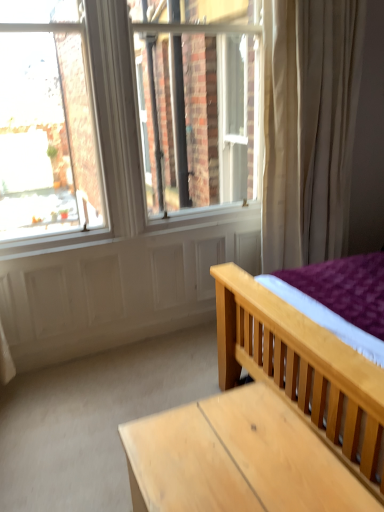
Question: Based on their positions, is light brown wooden table at lower right located to the left or right of light wood bed at center?

Choices:
 (A) right
 (B) left

Answer: (B)

Question: In the image, is light brown wooden table at lower right positioned in front of or behind light wood bed at center?

Choices:
 (A) front
 (B) behind

Answer: (B)

Question: Does point click(x=243, y=401) appear closer or farther from the camera than point click(x=225, y=334)?

Choices:
 (A) farther
 (B) closer

Answer: (B)

Question: From a real-world perspective, is light wood bed at center physically located above or below light brown wooden table at lower right?

Choices:
 (A) above
 (B) below

Answer: (A)

Question: Based on their sizes in the image, would you say light wood bed at center is bigger or smaller than light brown wooden table at lower right?

Choices:
 (A) small
 (B) big

Answer: (B)

Question: From their relative heights in the image, would you say light wood bed at center is taller or shorter than light brown wooden table at lower right?

Choices:
 (A) tall
 (B) short

Answer: (A)

Question: From the image's perspective, is light wood bed at center positioned above or below light brown wooden table at lower right?

Choices:
 (A) below
 (B) above

Answer: (B)